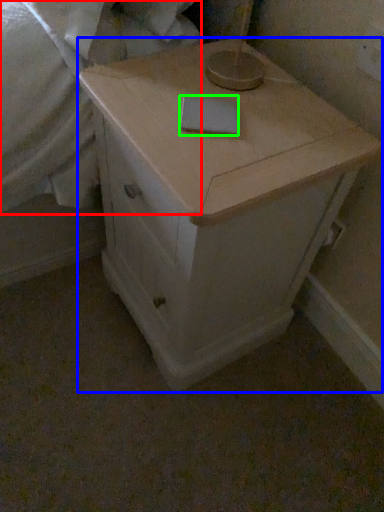
Question: Considering the real-world distances, which object is farthest from sheet (highlighted by a red box)? chest of drawers (highlighted by a blue box) or notepad (highlighted by a green box)?

Choices:
 (A) chest of drawers
 (B) notepad

Answer: (B)